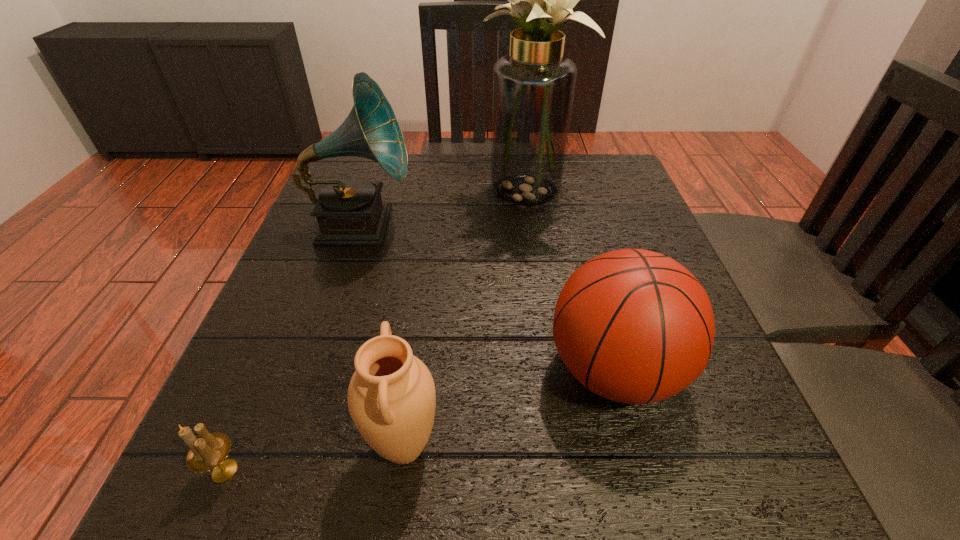
I want to click on object situated at the far right corner, so click(x=533, y=88).

The width and height of the screenshot is (960, 540). In the image, there is a desktop. Find the location of `free space at the far edge`. free space at the far edge is located at coordinates (417, 165).

The width and height of the screenshot is (960, 540). In the image, there is a desktop. Find the location of `vacant space at the near edge`. vacant space at the near edge is located at coordinates (568, 516).

Locate an element on the screen. Image resolution: width=960 pixels, height=540 pixels. vacant space at the left edge is located at coordinates (322, 432).

The width and height of the screenshot is (960, 540). What are the coordinates of `blank space at the right edge of the desktop` in the screenshot? It's located at (650, 224).

Where is `free space at the far right corner of the desktop`? free space at the far right corner of the desktop is located at coordinates (585, 159).

Where is `free area in between the basketball and the phonograph_record`? The width and height of the screenshot is (960, 540). free area in between the basketball and the phonograph_record is located at coordinates (488, 298).

Locate an element on the screen. free spot between the basketball and the urn is located at coordinates (510, 409).

Image resolution: width=960 pixels, height=540 pixels. Identify the location of unoccupied area between the candle holder and the phonograph_record. (293, 348).

Where is `free space that is in between the basketball and the urn`? The width and height of the screenshot is (960, 540). free space that is in between the basketball and the urn is located at coordinates (510, 409).